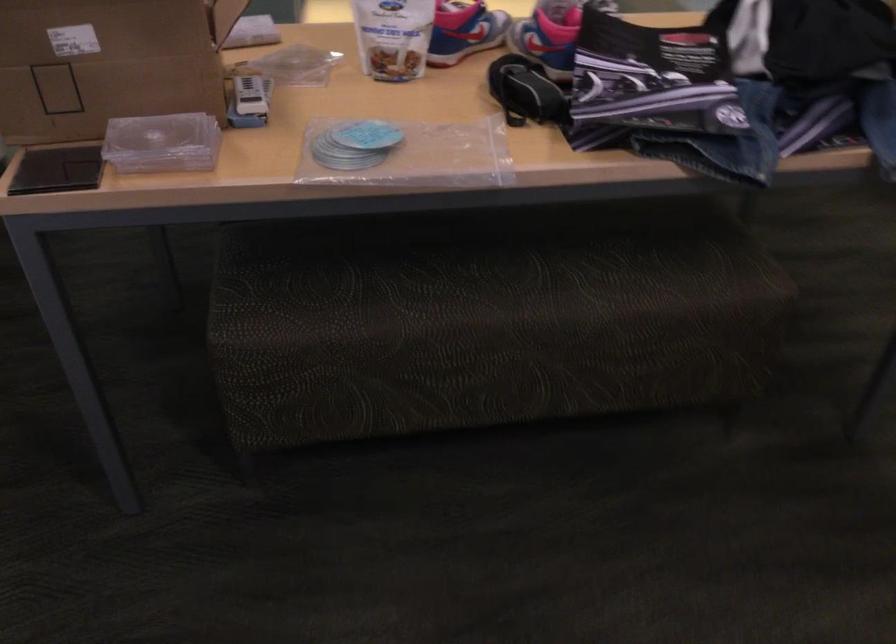
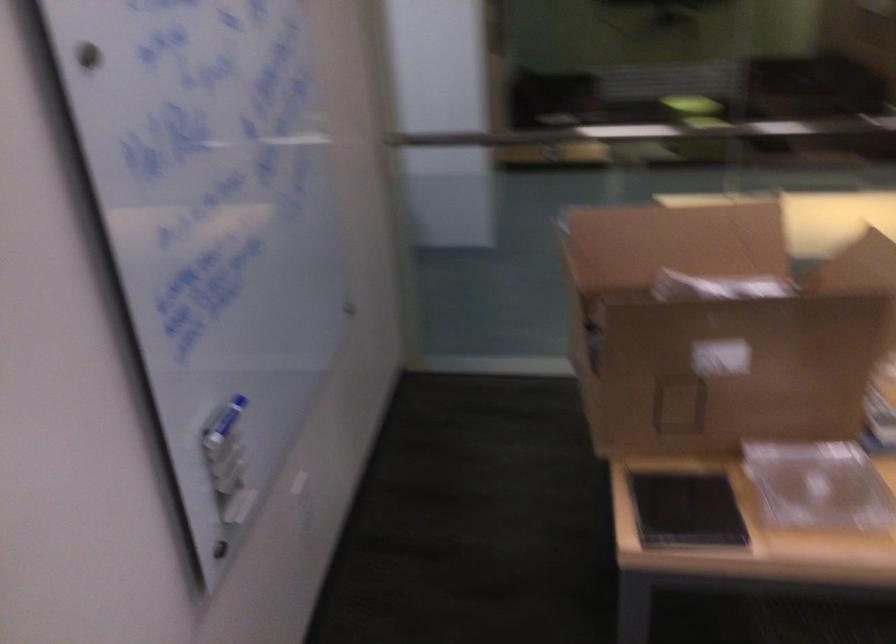
Question: The first image is from the beginning of the video and the second image is from the end. How did the camera likely rotate when shooting the video?

Choices:
 (A) Left
 (B) Right
 (C) Up
 (D) Down

Answer: (A)